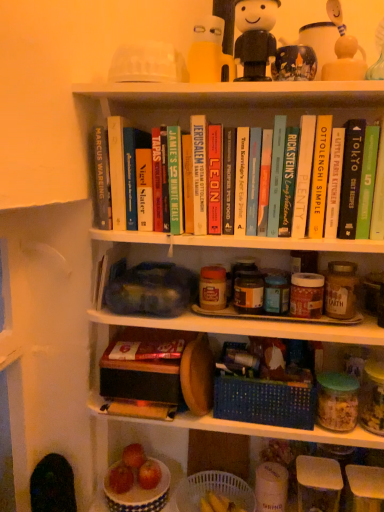
The height and width of the screenshot is (512, 384). What do you see at coordinates (276, 174) in the screenshot? I see `hardcover book at center, which ranks as the 7th book in left-to-right order` at bounding box center [276, 174].

What is the approximate height of hardcover book at center, which appears as the second book when viewed from the left?

It is 29.73 centimeters.

Where is `red matte apple at lower left, arranged as the third apple when viewed from the right`? This screenshot has height=512, width=384. red matte apple at lower left, arranged as the third apple when viewed from the right is located at coordinates (120, 478).

What is the approximate width of hardcover book at upper center, which is the fourth book in right-to-left order?

The width of hardcover book at upper center, which is the fourth book in right-to-left order, is 4.06 inches.

Image resolution: width=384 pixels, height=512 pixels. In order to click on yellow matte cup at upper center, marked as the third toy in a right-to-left arrangement in this screenshot , I will do `click(209, 53)`.

Find the location of a particular element. Image resolution: width=384 pixels, height=512 pixels. hardcover book at center, the 6th book positioned from the right is located at coordinates (276, 174).

Is point (211, 54) positioned in front of point (280, 53)?

No.

From the image's perspective, is yellow matte cup at upper center, marked as the third toy in a right-to-left arrangement, positioned above or below glossy ceramic mug at upper center, placed as the 2th toy when sorted from right to left?

Clearly, from the image's perspective, yellow matte cup at upper center, marked as the third toy in a right-to-left arrangement, is above glossy ceramic mug at upper center, placed as the 2th toy when sorted from right to left.

Considering the sizes of objects yellow matte cup at upper center, marked as the third toy in a right-to-left arrangement, and glossy ceramic mug at upper center, placed as the 2th toy when sorted from left to right, in the image provided, who is taller, yellow matte cup at upper center, marked as the third toy in a right-to-left arrangement, or glossy ceramic mug at upper center, placed as the 2th toy when sorted from left to right,?

With more height is yellow matte cup at upper center, marked as the third toy in a right-to-left arrangement.

Which point is more forward, (371, 210) or (106, 196)?

Positioned in front is point (371, 210).

Does green matte book at upper right, the 12th book positioned from the left, have a smaller size compared to hardcover book at upper left, the 12th book positioned from the right?

Indeed, green matte book at upper right, the 12th book positioned from the left, has a smaller size compared to hardcover book at upper left, the 12th book positioned from the right.

How distant is green matte book at upper right, marked as the 1th book in a right-to-left arrangement, from hardcover book at upper left, the 12th book positioned from the right?

24.21 inches.

Between hardcover book at upper center, placed as the 3th book when sorted from right to left, and hardcover book at center, positioned as the 4th book in left-to-right order, which one has smaller size?

With smaller size is hardcover book at upper center, placed as the 3th book when sorted from right to left.

Is hardcover book at upper center, which is the tenth book in left-to-right order, turned away from hardcover book at center, positioned as the 4th book in left-to-right order?

No, hardcover book at upper center, which is the tenth book in left-to-right order, is not facing the opposite direction of hardcover book at center, positioned as the 4th book in left-to-right order.

Identify the location of the 8th book positioned below the hardcover book at center, which is the 9th book from right to left (from the image's perspective). Image resolution: width=384 pixels, height=512 pixels. (334, 183).

From the image's perspective, who appears lower, hardcover book at center, positioned as the 4th book in left-to-right order, or hardcover book at upper left, the 12th book positioned from the right?

hardcover book at center, positioned as the 4th book in left-to-right order, is shown below in the image.

How far apart are hardcover book at center, positioned as the 4th book in left-to-right order, and hardcover book at upper left, the 12th book positioned from the right?

hardcover book at center, positioned as the 4th book in left-to-right order, is 9.09 inches from hardcover book at upper left, the 12th book positioned from the right.

Looking at this image, what's the angular difference between hardcover book at center, which is the 9th book from right to left, and hardcover book at upper left, the 12th book positioned from the right,'s facing directions?

The facing directions of hardcover book at center, which is the 9th book from right to left, and hardcover book at upper left, the 12th book positioned from the right, are 4.62 degrees apart.

Can hardcover book at upper left, the 12th book positioned from the right, be found inside hardcover book at center, which is the 9th book from right to left?

Actually, hardcover book at upper left, the 12th book positioned from the right, is outside hardcover book at center, which is the 9th book from right to left.

From a real-world perspective, is hardcover book at center, which ranks as the 7th book in right-to-left order, positioned above or below hardcover book at center, which appears as the second book when viewed from the left?

hardcover book at center, which ranks as the 7th book in right-to-left order, is situated lower than hardcover book at center, which appears as the second book when viewed from the left, in the real world.

Which of these two, hardcover book at center, which appears as the sixth book when viewed from the left, or hardcover book at center, which appears as the second book when viewed from the left, stands shorter?

Standing shorter between the two is hardcover book at center, which appears as the sixth book when viewed from the left.

Can you tell me how much hardcover book at center, which ranks as the 7th book in right-to-left order, and hardcover book at center, which is the 11th book from right to left, differ in facing direction?

The angle between the facing direction of hardcover book at center, which ranks as the 7th book in right-to-left order, and the facing direction of hardcover book at center, which is the 11th book from right to left, is 0.609 degrees.

Which object is further away from the camera, hardcover book at center, which ranks as the 7th book in right-to-left order, or hardcover book at center, which appears as the second book when viewed from the left?

hardcover book at center, which appears as the second book when viewed from the left, is further away from the camera.

Which is closer to the camera, (119,455) or (288,196)?

The point (288,196) is closer.

Is white ceramic bowl at lower left, positioned as the first shelf in bottom-to-top order, touching hardcover book at center, placed as the eighth book when sorted from left to right?

There is a gap between white ceramic bowl at lower left, positioned as the first shelf in bottom-to-top order, and hardcover book at center, placed as the eighth book when sorted from left to right.

Considering the relative sizes of white ceramic bowl at lower left, positioned as the first shelf in bottom-to-top order, and hardcover book at center, placed as the eighth book when sorted from left to right, in the image provided, is white ceramic bowl at lower left, positioned as the first shelf in bottom-to-top order, wider than hardcover book at center, placed as the eighth book when sorted from left to right,?

Correct, the width of white ceramic bowl at lower left, positioned as the first shelf in bottom-to-top order, exceeds that of hardcover book at center, placed as the eighth book when sorted from left to right.

Which of these two, white ceramic bowl at lower left, positioned as the first shelf in bottom-to-top order, or hardcover book at center, placed as the eighth book when sorted from left to right, stands taller?

Standing taller between the two is hardcover book at center, placed as the eighth book when sorted from left to right.

Measure the distance from white plastic basket at lower center, arranged as the 2th basket when viewed from the top, to hardcover book at center, which is the 11th book from right to left.

white plastic basket at lower center, arranged as the 2th basket when viewed from the top, is 34.43 inches from hardcover book at center, which is the 11th book from right to left.

Between white plastic basket at lower center, which ranks as the 1th basket in bottom-to-top order, and hardcover book at center, which is the 11th book from right to left, which one appears on the right side from the viewer's perspective?

Positioned to the right is white plastic basket at lower center, which ranks as the 1th basket in bottom-to-top order.

From the image's perspective, which is above, white plastic basket at lower center, arranged as the 2th basket when viewed from the top, or hardcover book at center, which appears as the second book when viewed from the left?

hardcover book at center, which appears as the second book when viewed from the left, from the image's perspective.

The height and width of the screenshot is (512, 384). I want to click on the 1st toy counting from the right of the yellow matte cup at upper center, marked as the third toy in a right-to-left arrangement, so click(x=294, y=63).

Which book is the 11th one when counting from the left side of the green matte book at upper right, marked as the 1th book in a right-to-left arrangement? Please provide its 2D coordinates.

[(101, 180)]

Estimate the real-world distances between objects in this image. Which object is further from hardcover book at center, the 6th book positioned from the right, hardcover book at center, which appears as the second book when viewed from the left, or red matte apple at lower center, the 2th apple viewed from the left?

Among the two, red matte apple at lower center, the 2th apple viewed from the left, is located further to hardcover book at center, the 6th book positioned from the right.

Estimate the real-world distances between objects in this image. Which object is closer to hardcover book at upper left, the first book viewed from the left, red matte apple at lower left, which is the 1th apple in left-to-right order, or blue woven basket at center, the 1th basket from the top?

blue woven basket at center, the 1th basket from the top, lies closer to hardcover book at upper left, the first book viewed from the left, than the other object.

Considering their positions, is red matte apple at lower left, which is the 1th apple in left-to-right order, positioned closer to hardcover book at center, arranged as the 5th book when viewed from the left, than plastic toy figure at upper center?

plastic toy figure at upper center is positioned closer to the anchor hardcover book at center, arranged as the 5th book when viewed from the left.

Which object lies nearer to the anchor point hardcover book at upper left, the first book viewed from the left, hardcover book at upper center, which is the tenth book in left-to-right order, or white ceramic bowl at lower left, the 3th shelf viewed from the top?

hardcover book at upper center, which is the tenth book in left-to-right order.

Which object lies further to the anchor point hardcover book at upper center, which is the tenth book in left-to-right order, hardcover book at upper center, the 9th book in the left-to-right sequence, or glossy ceramic mug at upper center, placed as the 2th toy when sorted from right to left?

glossy ceramic mug at upper center, placed as the 2th toy when sorted from right to left.

Considering their positions, is wooden cutting board at center, arranged as the 2th shelf when ordered from the bottom, positioned further to hardcover book at upper center, placed as the 3th book when sorted from right to left, than hardcover book at upper center, which is the fourth book in right-to-left order?

wooden cutting board at center, arranged as the 2th shelf when ordered from the bottom.

When comparing their distances from red matte apple at lower left, which is the 1th apple in left-to-right order, does glossy ceramic mug at upper center, placed as the 2th toy when sorted from right to left, or hardcover book at center, which ranks as the 7th book in right-to-left order, seem further?

Among the two, glossy ceramic mug at upper center, placed as the 2th toy when sorted from right to left, is located further to red matte apple at lower left, which is the 1th apple in left-to-right order.

Which object lies further to the anchor point hardcover book at center, arranged as the third book when viewed from the left, glossy ceramic mug at upper center, placed as the 2th toy when sorted from right to left, or hardcover book at center, which appears as the sixth book when viewed from the left?

glossy ceramic mug at upper center, placed as the 2th toy when sorted from right to left, lies further to hardcover book at center, arranged as the third book when viewed from the left, than the other object.

At what (x,y) coordinates should I click in order to perform the action: click on shelf between hardcover book at upper center, which is the tenth book in left-to-right order, and blue woven basket at center, the 1th basket from the top, vertically. Please return your answer as a coordinate pair (x, y). Image resolution: width=384 pixels, height=512 pixels. Looking at the image, I should click on (238, 323).

The height and width of the screenshot is (512, 384). Find the location of `figurine located between hardcover book at center, arranged as the third book when viewed from the left, and hardcover book at upper right, the 11th book when ordered from left to right, in the left-right direction`. figurine located between hardcover book at center, arranged as the third book when viewed from the left, and hardcover book at upper right, the 11th book when ordered from left to right, in the left-right direction is located at coordinates (255, 37).

The width and height of the screenshot is (384, 512). Find the location of `toy between hardcover book at center, which appears as the second book when viewed from the left, and glossy ceramic mug at upper center, placed as the 2th toy when sorted from right to left, in the horizontal direction`. toy between hardcover book at center, which appears as the second book when viewed from the left, and glossy ceramic mug at upper center, placed as the 2th toy when sorted from right to left, in the horizontal direction is located at coordinates (209, 53).

Locate an element on the screen. This screenshot has height=512, width=384. basket that lies between hardcover book at center, arranged as the 8th book when viewed from the right, and red matte apple at lower center, the 2th apple viewed from the left, from top to bottom is located at coordinates (264, 401).